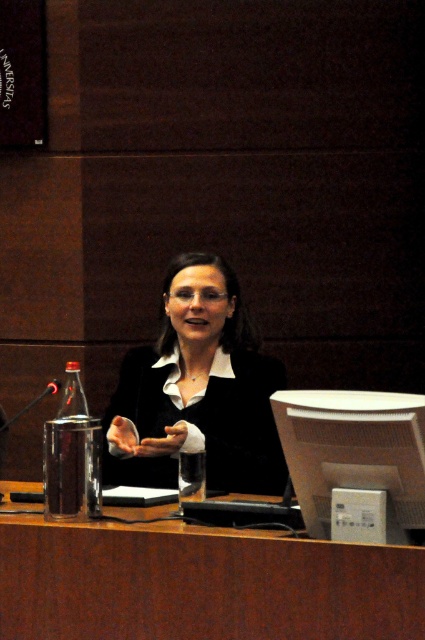
You are a stagehand preparing to set up a microphone stand for the presenter. The stand requires 1.8 meters of space to be placed safely behind the brown wood table at center. Can you position it there?

The distance between the brown wood table at center and the camera is 1.71 meters, which is less than the required 1.8 meters needed for the microphone stand. Therefore, you cannot safely position it there.

You are standing at the entrance of the lecture hall and want to place a large presentation folder on the brown wood table at center. Based on the coordinates provided, is the table positioned near the front or the back of the room?

The brown wood table at center is located at point [201,582], which indicates it is positioned near the front of the room.